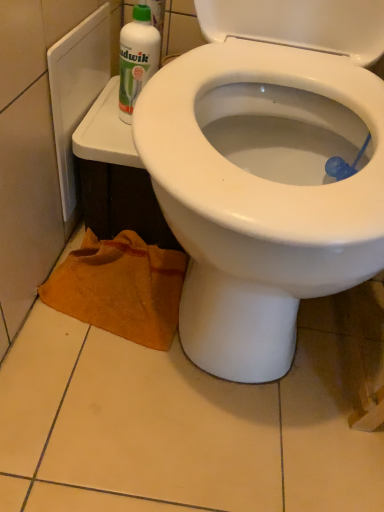
Where is `free point in front of orange towel at lower left`? This screenshot has height=512, width=384. free point in front of orange towel at lower left is located at coordinates (104, 393).